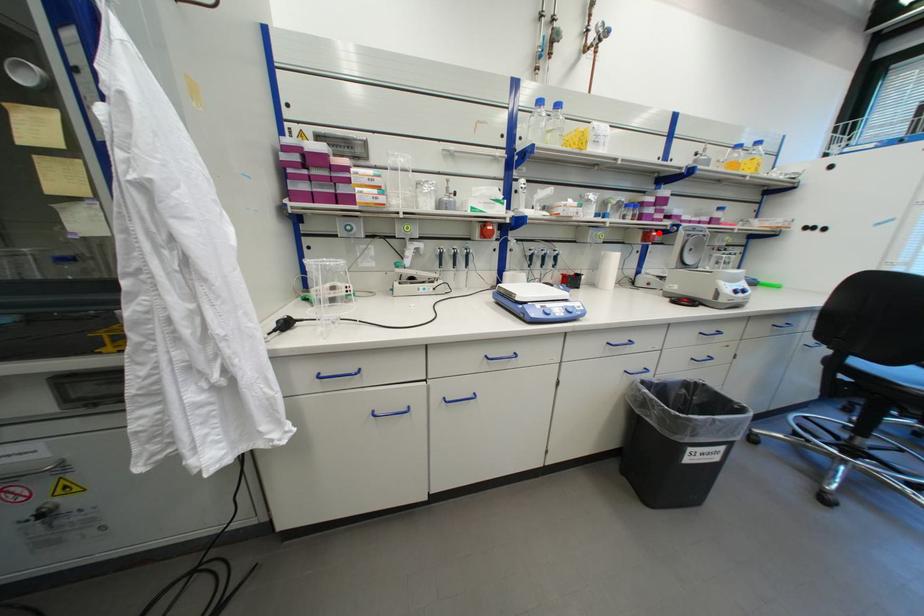
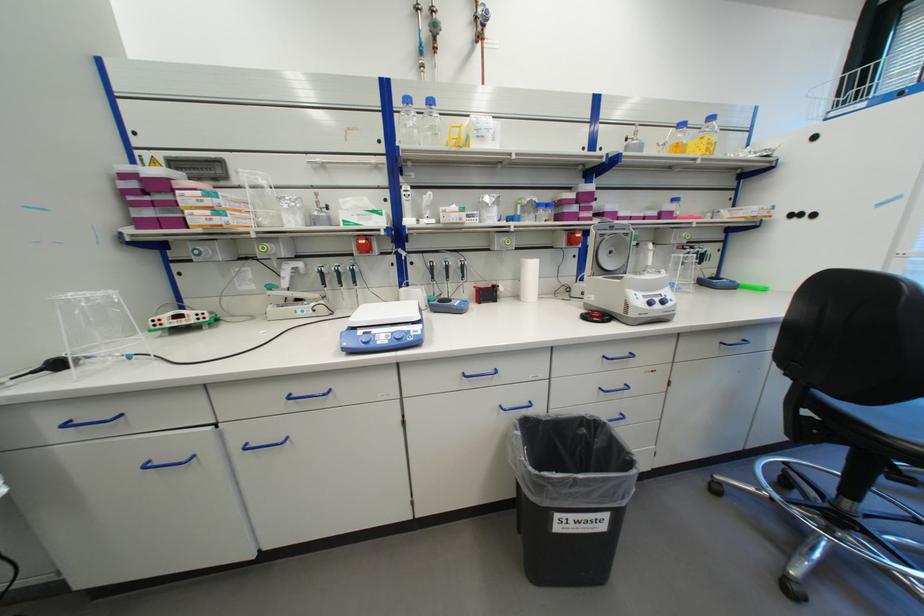
In the second image, find the point that corresponds to the highlighted location in the first image.

(581, 235)